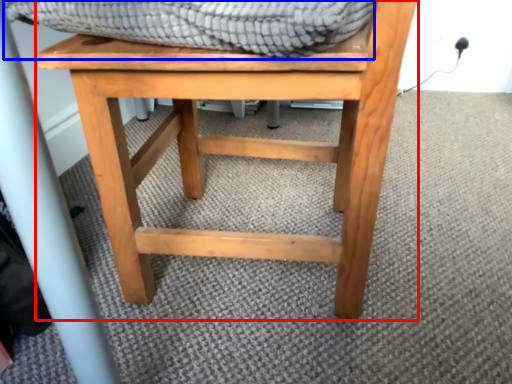
Question: Which object appears farthest to the camera in this image, stool (highlighted by a red box) or blanket (highlighted by a blue box)?

Choices:
 (A) stool
 (B) blanket

Answer: (A)